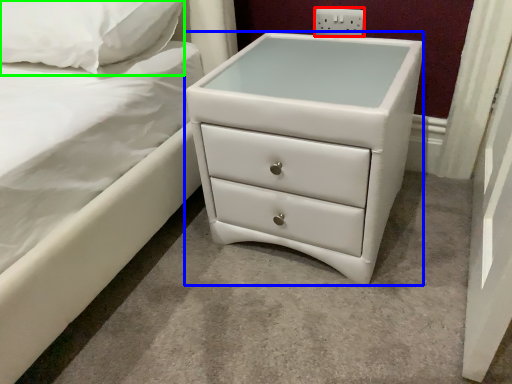
Question: Estimate the real-world distances between objects in this image. Which object is closer to electric outlet (highlighted by a red box), chest of drawers (highlighted by a blue box) or pillow (highlighted by a green box)?

Choices:
 (A) chest of drawers
 (B) pillow

Answer: (A)